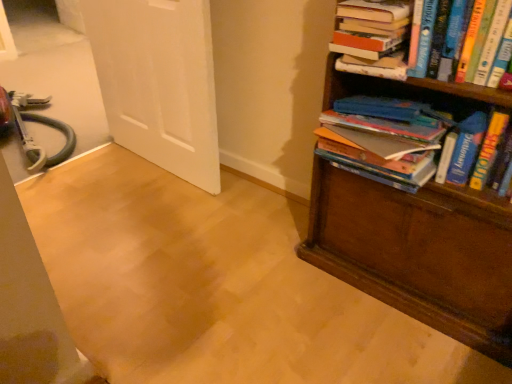
Question: Looking at their shapes, would you say white matte door at upper left is wider or thinner than hardcover books at right, the first book in the bottom-to-top sequence?

Choices:
 (A) wide
 (B) thin

Answer: (B)

Question: Looking at the image, does white matte door at upper left seem bigger or smaller compared to hardcover books at right, which is the 3th book in top-to-bottom order?

Choices:
 (A) small
 (B) big

Answer: (B)

Question: Which object is positioned closest to the hardcover book at upper right, the second book in the top-to-bottom sequence?

Choices:
 (A) white matte door at upper left
 (B) hardcover book at upper right, positioned as the third book in bottom-to-top order
 (C) hardcover books at right, which is the 3th book in top-to-bottom order
 (D) brown wooden bookcase at right

Answer: (B)

Question: Based on their relative distances, which object is nearer to the hardcover book at upper right, the second book in the top-to-bottom sequence?

Choices:
 (A) hardcover book at upper right, the first book viewed from the top
 (B) white matte door at upper left
 (C) brown wooden bookcase at right
 (D) hardcover books at right, which is the 3th book in top-to-bottom order

Answer: (A)